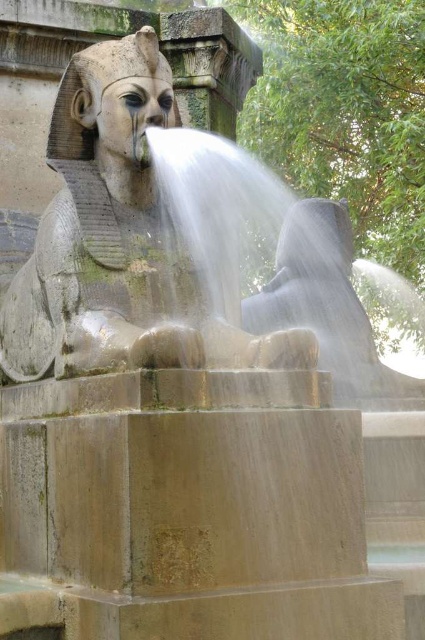
Question: Does stone statue at center appear on the left side of clear water at sphinx center?

Choices:
 (A) no
 (B) yes

Answer: (B)

Question: Which point appears farthest from the camera in this image?

Choices:
 (A) (189, 241)
 (B) (101, 145)

Answer: (A)

Question: Can you confirm if stone statue at center is positioned to the right of clear water at sphinx center?

Choices:
 (A) no
 (B) yes

Answer: (A)

Question: Which point appears farthest from the camera in this image?

Choices:
 (A) (62, 365)
 (B) (209, 280)

Answer: (B)

Question: Does stone statue at center have a larger size compared to clear water at sphinx center?

Choices:
 (A) no
 (B) yes

Answer: (A)

Question: Which of the following is the closest to the observer?

Choices:
 (A) clear water at sphinx center
 (B) stone statue at center

Answer: (B)